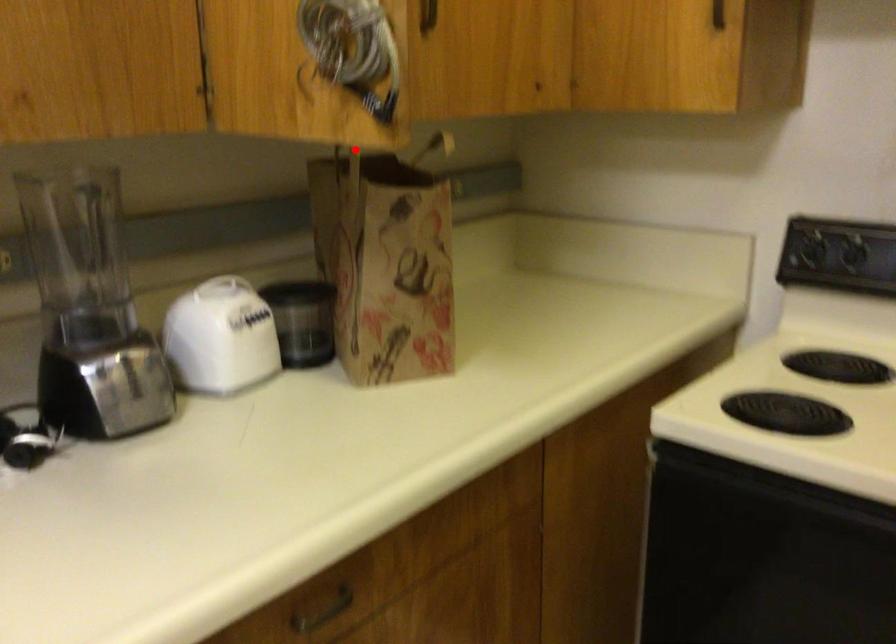
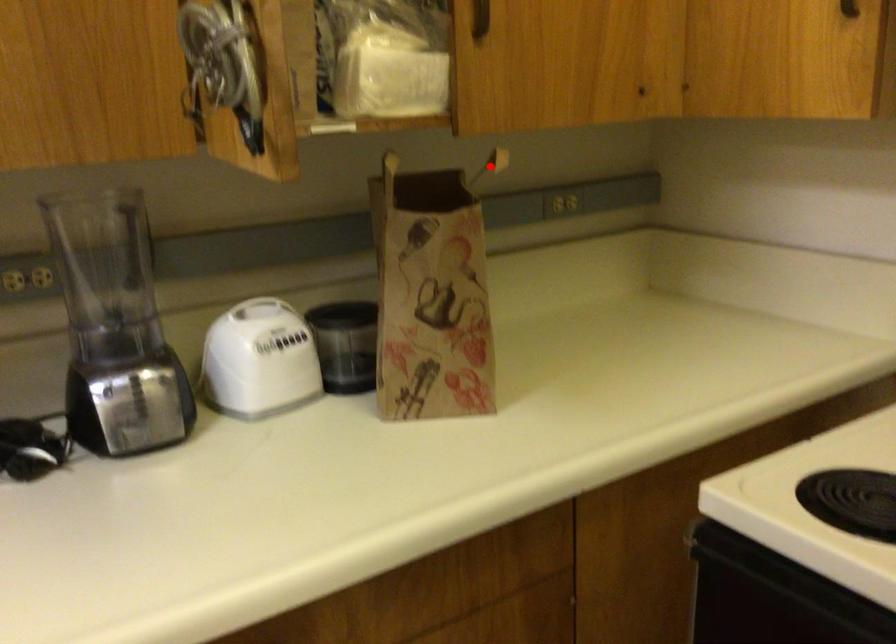
I am providing you with two images of the same scene from different viewpoints. A red point is marked on the first image and another point is marked on the second image. Is the red point in image1 aligned with the point shown in image2?

No